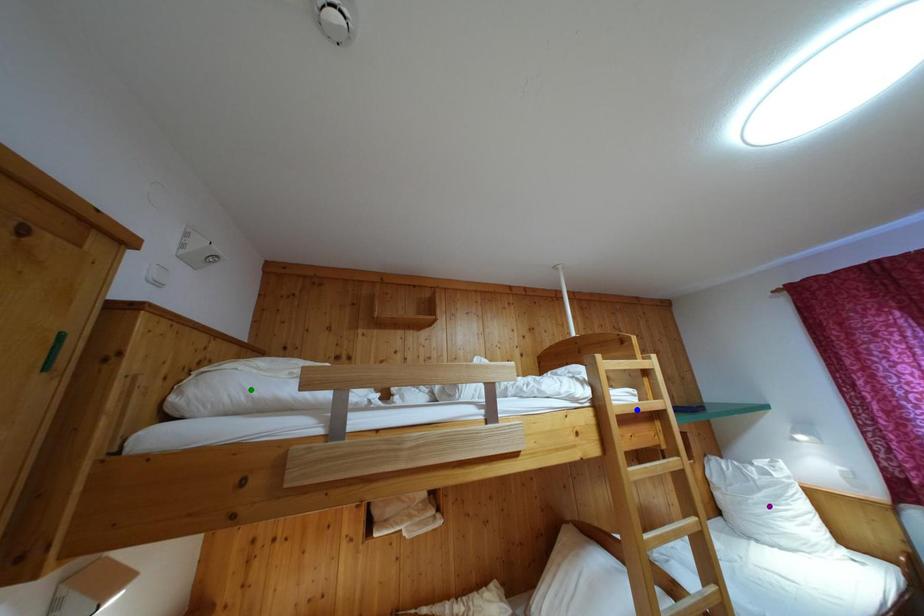
Order these from nearest to farthest:
A) green point
B) blue point
C) purple point

1. green point
2. blue point
3. purple point